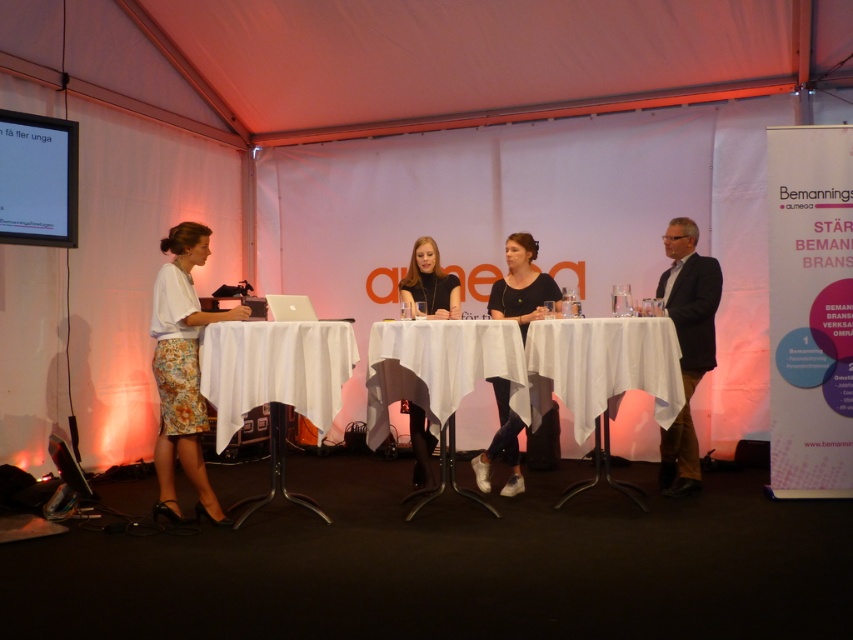
In the scene shown: You are organizing a small event and need to place a 1.2 meter wide banner between the white cloth table at center and the white floral skirt at left. Based on the scene description, will the banner fit horizontally between them?

The white cloth table at center is wider than the white floral skirt at left. However, the exact distance between them isn not provided in the scene description. To determine if the banner will fit, you would need to measure the space between them or ensure that the total available width exceeds 1.2 meters.

Looking at this image, you are attending a panel discussion and want to move from the front of the stage to the back. Which point should you aim for first, point (482, 458) or point (422, 420)?

You should aim for point (422, 420) first because point (482, 458) is behind it.

Based on the photo, you are organizing a panel discussion and need to place a name tag between the white fabric table at center and the dark blue suit at right. The name tag requires 3 feet of space to be visible. Is there enough space between them?

The white fabric table at center and dark blue suit at right are 4.55 feet apart from each other, which is more than the required 3 feet. Therefore, there is sufficient space to place the name tag between them.